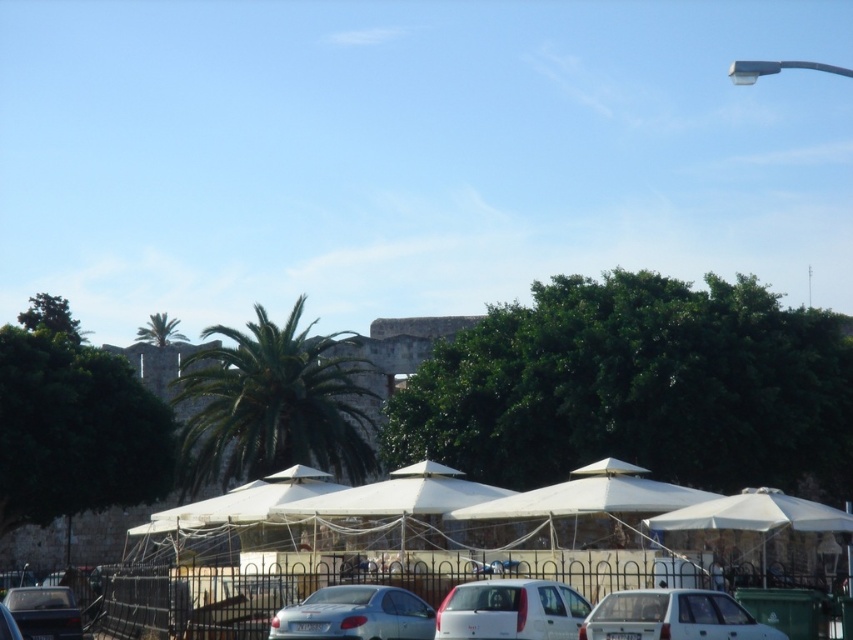
Based on the photo, you are standing in the outdoor seating area and want to take a photo of the historical wall behind the umbrellas. Which palm tree, the green leafy palm tree at center or the green leafy palm tree at upper left, is closer to you and might block your view of the wall?

The green leafy palm tree at center is closer to you and might block your view of the historical wall because it is positioned in front of the green leafy palm tree at upper left.

You are planning to set up a new table under the green leafy palm tree at center and the white fabric umbrella at center. Based on their widths, which object would require more space horizontally to accommodate the table?

The green leafy palm tree at center has a larger width than the white fabric umbrella at center, so it would require more horizontal space to accommodate the table.

You are taking a photo of the outdoor scene with your camera positioned at the same level as the two points. Which point, point (677, 616) or point (700, 522), is closer to your camera?

Point (677, 616) is closer to the camera than point (700, 522).